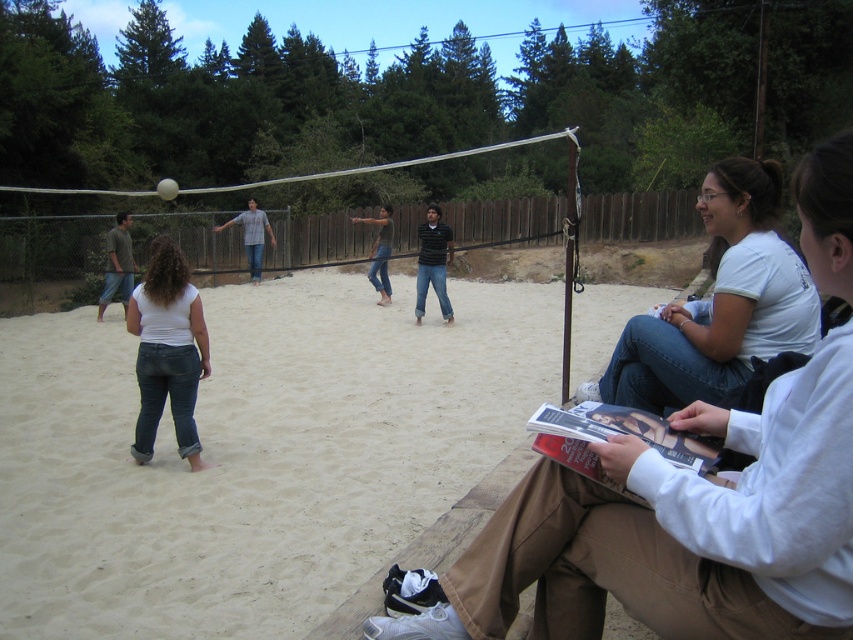
Who is shorter, white cotton shirt at right or denim jeans at center?

With less height is denim jeans at center.

Who is higher up, white cotton shirt at right or denim jeans at center?

denim jeans at center

Locate an element on the screen. This screenshot has height=640, width=853. white cotton shirt at right is located at coordinates (718, 304).

Does beige sand at center come in front of denim jeans at center?

Yes, beige sand at center is in front of denim jeans at center.

Who is shorter, beige sand at center or denim jeans at center?

denim jeans at center is shorter.

Is point (256, 592) more distant than point (390, 209)?

No, (256, 592) is closer to viewer.

Find the location of a particular element. beige sand at center is located at coordinates (253, 454).

Find the location of `striped cotton shirt at center`. striped cotton shirt at center is located at coordinates (433, 262).

Which is below, striped cotton shirt at center or denim jeans at center?

denim jeans at center

Is point (422, 289) closer to camera compared to point (384, 224)?

Yes, it is.

Locate an element on the screen. Image resolution: width=853 pixels, height=640 pixels. striped cotton shirt at center is located at coordinates (433, 262).